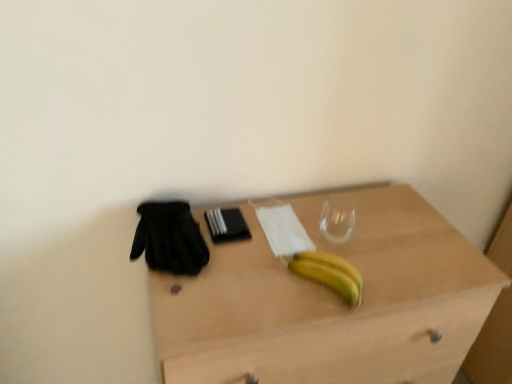
You are a GUI agent. You are given a task and a screenshot of the screen. Output one action in this format:
    pyautogui.click(x=<x>, y=<y>)
    Task: Click on the light wood desk at center
    
    Given the screenshot: What is the action you would take?
    pyautogui.click(x=330, y=302)

You are a GUI agent. You are given a task and a screenshot of the screen. Output one action in this format:
    pyautogui.click(x=<x>, y=<y>)
    Task: Click on the light wood desk at center
    The image size is (512, 384).
    Given the screenshot: What is the action you would take?
    pyautogui.click(x=330, y=302)

Which point is more forward, (139, 241) or (428, 340)?

The point (139, 241) is more forward.

Is black mesh glove at left looking in the opposite direction of light wood desk at center?

No.

From a real-world perspective, is black mesh glove at left positioned under light wood desk at center based on gravity?

No, from a real-world perspective, black mesh glove at left is not under light wood desk at center.

Considering the positions of objects black mesh glove at left and light wood desk at center in the image provided, who is more to the right, black mesh glove at left or light wood desk at center?

Positioned to the right is light wood desk at center.

Considering their positions, is black mesh glove at left located in front of or behind yellow matte banana at center?

In the image, black mesh glove at left appears behind yellow matte banana at center.

Is black mesh glove at left next to yellow matte banana at center?

No, black mesh glove at left is not in contact with yellow matte banana at center.

From the image's perspective, between black mesh glove at left and yellow matte banana at center, which one is located above?

From the image's view, black mesh glove at left is above.

From the picture: Considering the relative positions of black mesh glove at left and yellow matte banana at center in the image provided, is black mesh glove at left to the left or to the right of yellow matte banana at center?

black mesh glove at left is positioned on yellow matte banana at center's left side.

In the image, is light wood desk at center positioned in front of or behind black mesh glove at left?

In the image, light wood desk at center appears in front of black mesh glove at left.

Which of these two, light wood desk at center or black mesh glove at left, is smaller?

Smaller between the two is black mesh glove at left.

From the picture: Would you say light wood desk at center contains black mesh glove at left?

That's correct, black mesh glove at left is inside light wood desk at center.

From the image's perspective, between light wood desk at center and black mesh glove at left, which one is located above?

From the image's view, black mesh glove at left is above.

Does light wood desk at center turn towards yellow matte banana at center?

No, light wood desk at center is not turned towards yellow matte banana at center.

How different are the orientations of light wood desk at center and yellow matte banana at center in degrees?

The angular difference between light wood desk at center and yellow matte banana at center is 66.5 degrees.

From the image's perspective, relative to yellow matte banana at center, is light wood desk at center above or below?

Based on their image positions, light wood desk at center is located beneath yellow matte banana at center.

Is yellow matte banana at center positioned with its back to light wood desk at center?

No, yellow matte banana at center's orientation is not away from light wood desk at center.

Where is `desk on the left of yellow matte banana at center`? Image resolution: width=512 pixels, height=384 pixels. desk on the left of yellow matte banana at center is located at coordinates (330, 302).

Is yellow matte banana at center in contact with light wood desk at center?

No, yellow matte banana at center is not touching light wood desk at center.

From the image's perspective, is yellow matte banana at center above or below black mesh glove at left?

yellow matte banana at center is below black mesh glove at left.

How far apart are yellow matte banana at center and black mesh glove at left?

The distance of yellow matte banana at center from black mesh glove at left is 10.24 inches.

Considering the positions of point (308, 264) and point (186, 222), is point (308, 264) closer or farther from the camera than point (186, 222)?

Point (308, 264) appears to be closer to the viewer than point (186, 222).

Is yellow matte banana at center wider than black mesh glove at left?

No, yellow matte banana at center is not wider than black mesh glove at left.

Image resolution: width=512 pixels, height=384 pixels. What are the coordinates of `desk that appears below the black mesh glove at left (from the image's perspective)` in the screenshot? It's located at (330, 302).

The height and width of the screenshot is (384, 512). I want to click on banana that is on the right side of black mesh glove at left, so click(330, 273).

Looking at the image, which one is located further to black mesh glove at left, light wood desk at center or yellow matte banana at center?

Among the two, light wood desk at center is located further to black mesh glove at left.

Estimate the real-world distances between objects in this image. Which object is further from light wood desk at center, black mesh glove at left or yellow matte banana at center?

The object further to light wood desk at center is black mesh glove at left.

Which object lies nearer to the anchor point yellow matte banana at center, black mesh glove at left or light wood desk at center?

Based on the image, light wood desk at center appears to be nearer to yellow matte banana at center.

Considering their positions, is light wood desk at center positioned closer to yellow matte banana at center than black mesh glove at left?

light wood desk at center is positioned closer to the anchor yellow matte banana at center.

Looking at the image, which one is located further to black mesh glove at left, yellow matte banana at center or light wood desk at center?

light wood desk at center.

When comparing their distances from light wood desk at center, does yellow matte banana at center or black mesh glove at left seem further?

black mesh glove at left is positioned further to the anchor light wood desk at center.

Find the location of `banana between black mesh glove at left and light wood desk at center vertically`. banana between black mesh glove at left and light wood desk at center vertically is located at coordinates (330, 273).